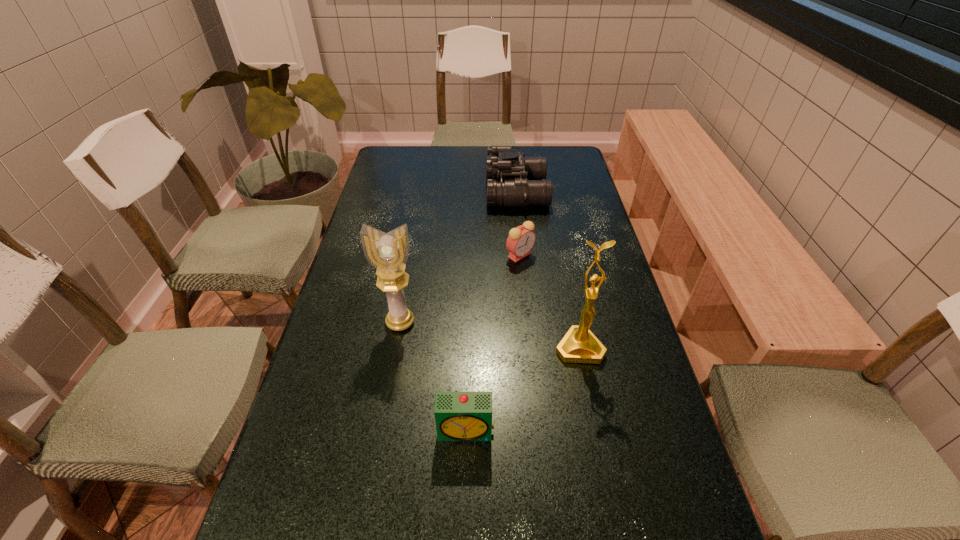
Where is `empty space between the third tallest object and the right award`? empty space between the third tallest object and the right award is located at coordinates (548, 269).

At what (x,y) coordinates should I click in order to perform the action: click on unoccupied position between the right alarm clock and the leftmost object. Please return your answer as a coordinate pair (x, y). Looking at the image, I should click on (460, 289).

This screenshot has width=960, height=540. In order to click on unoccupied position between the nearer alarm clock and the farthest object in this screenshot , I will do `click(492, 312)`.

This screenshot has width=960, height=540. What are the coordinates of `object that is the fourth closest one to the leftmost object` in the screenshot? It's located at (513, 180).

Point out which object is positioned as the nearest to the nearer alarm clock. Please provide its 2D coordinates. Your answer should be formatted as a tuple, i.e. [(x, y)], where the tuple contains the x and y coordinates of a point satisfying the conditions above.

[(579, 345)]

Where is `vacant region that satisfies the following two spatial constraints: 1. through the lenses of the farthest object; 2. on the front-facing side of the nearest object`? This screenshot has width=960, height=540. vacant region that satisfies the following two spatial constraints: 1. through the lenses of the farthest object; 2. on the front-facing side of the nearest object is located at coordinates (543, 431).

Find the location of `free spot that satisfies the following two spatial constraints: 1. through the lenses of the third tallest object; 2. on the face of the right alarm clock`. free spot that satisfies the following two spatial constraints: 1. through the lenses of the third tallest object; 2. on the face of the right alarm clock is located at coordinates (524, 255).

In order to click on free spot that satisfies the following two spatial constraints: 1. through the lenses of the farthest object; 2. on the front-facing side of the leftmost object in this screenshot , I will do `click(532, 322)`.